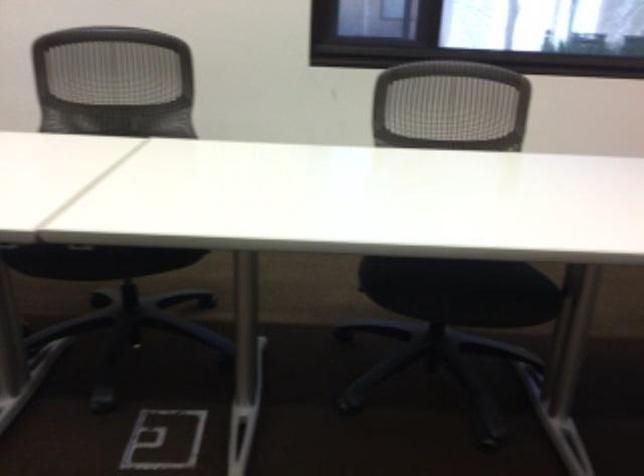
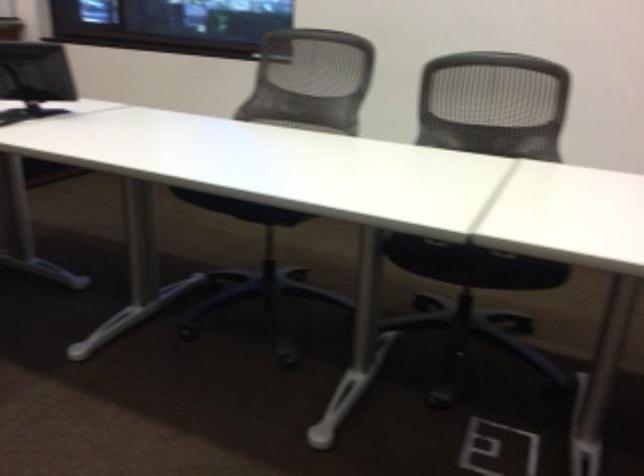
Question: Based on the continuous images, in which direction is the camera rotating? Reply with the corresponding letter.

Choices:
 (A) Left
 (B) Right
 (C) Up
 (D) Down

Answer: (A)